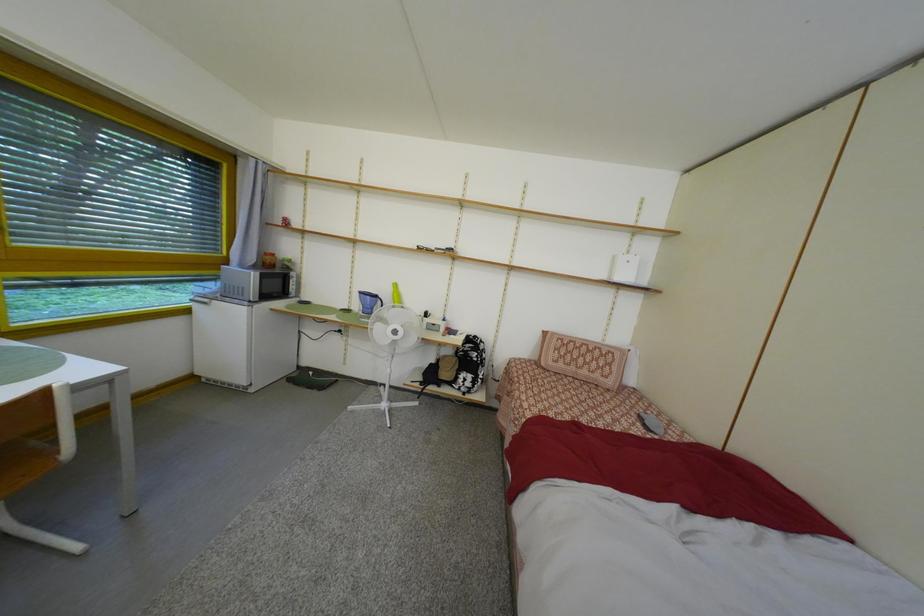
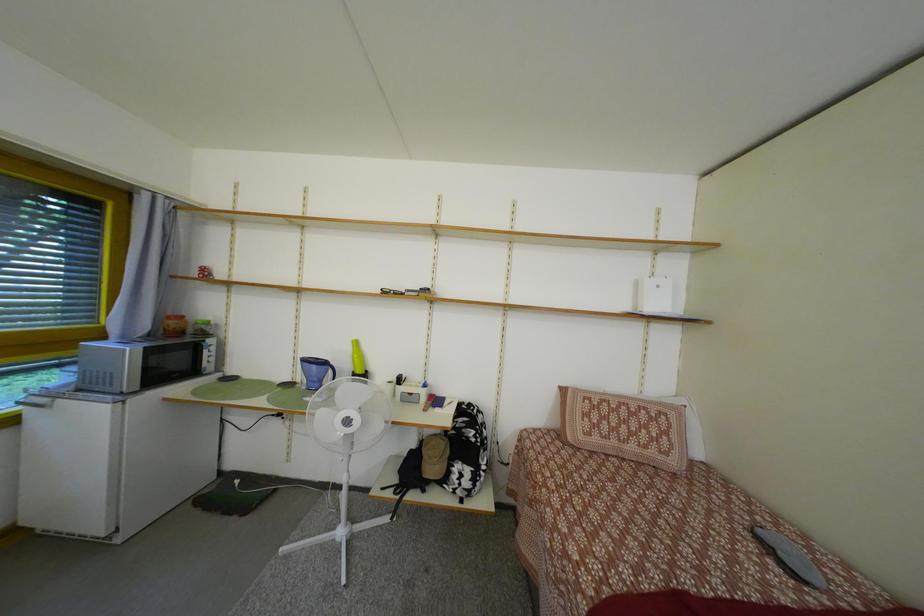
Question: In a continuous first-person perspective shot, in which direction is the camera moving?

Choices:
 (A) Left
 (B) Right
 (C) Forward
 (D) Backward

Answer: (C)